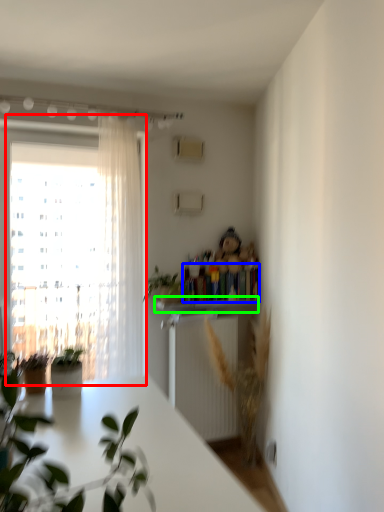
Question: Based on their relative distances, which object is nearer to window (highlighted by a red box)? Choose from book (highlighted by a blue box) and window sill (highlighted by a green box).

Choices:
 (A) book
 (B) window sill

Answer: (B)